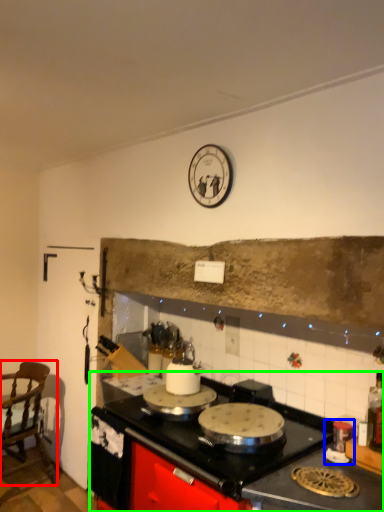
Question: Which is farther away from chair (highlighted by a red box)? appliance (highlighted by a blue box) or countertop (highlighted by a green box)?

Choices:
 (A) appliance
 (B) countertop

Answer: (A)